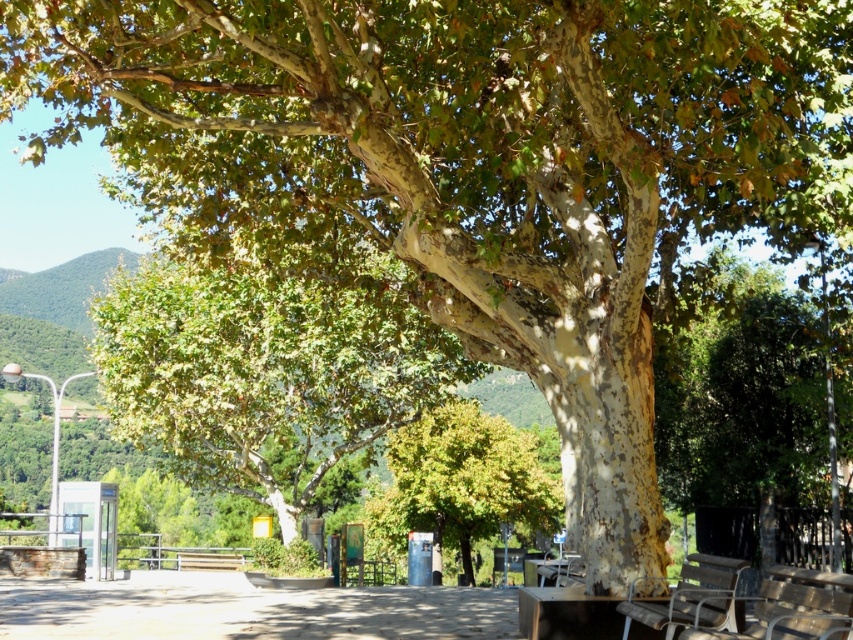
You are standing in the outdoor scene and want to take a photo. You notice two points in the scene at coordinates point (157,342) and point (389,536). Which point is closer to your current position?

Point (157,342) is closer to the camera than point (389,536), so it is closer to your current position.

You are standing in the middle of a forest clearing and see the green rough bark tree at center. You want to take a photo of it from exactly 10 meters away. Is the tree currently within your desired distance range?

The green rough bark tree at center is 12.71 meters away from the camera, which is beyond the desired 10 meters distance. To capture it within 10 meters, you need to move closer by 2.71 meters.

You are a visitor sitting on the wooden bench at lower right and want to move to the metallic silver bench at lower right. Which direction should you move to reach it?

The metallic silver bench at lower right is above the wooden bench at lower right, so you should move upward to reach it.